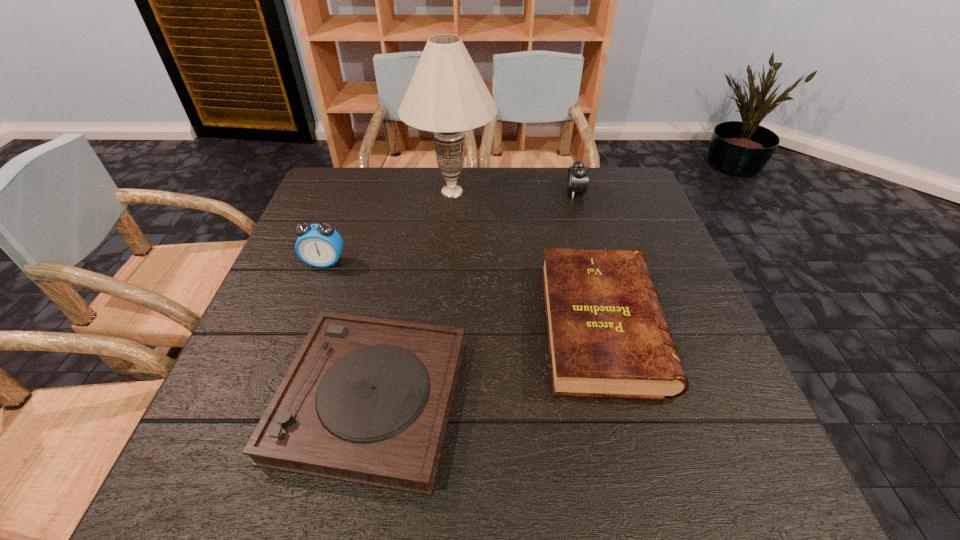
Find the location of a particular element. object present at the near left corner is located at coordinates (366, 400).

Where is `blank space at the far edge of the desktop`? The width and height of the screenshot is (960, 540). blank space at the far edge of the desktop is located at coordinates (479, 201).

The width and height of the screenshot is (960, 540). In order to click on vacant space at the right edge of the desktop in this screenshot , I will do `click(707, 364)`.

The height and width of the screenshot is (540, 960). I want to click on vacant point at the far left corner, so click(354, 183).

I want to click on free spot at the far right corner of the desktop, so click(x=627, y=206).

This screenshot has width=960, height=540. What are the coordinates of `empty space that is in between the hardback book and the phonograph record` in the screenshot? It's located at (487, 362).

Where is `vacant region between the hardback book and the lampshade`? vacant region between the hardback book and the lampshade is located at coordinates pos(527,259).

You are a GUI agent. You are given a task and a screenshot of the screen. Output one action in this format:
    pyautogui.click(x=<x>, y=<y>)
    Task: Click on the vacant point located between the left alarm clock and the lampshade
    The image size is (960, 540).
    Given the screenshot: What is the action you would take?
    pyautogui.click(x=389, y=227)

You are a GUI agent. You are given a task and a screenshot of the screen. Output one action in this format:
    pyautogui.click(x=<x>, y=<y>)
    Task: Click on the vacant area that lies between the hardback book and the lampshade
    This screenshot has height=540, width=960.
    Given the screenshot: What is the action you would take?
    pyautogui.click(x=527, y=259)

The image size is (960, 540). What are the coordinates of `vacant space that's between the lampshade and the hardback book` in the screenshot? It's located at (527, 259).